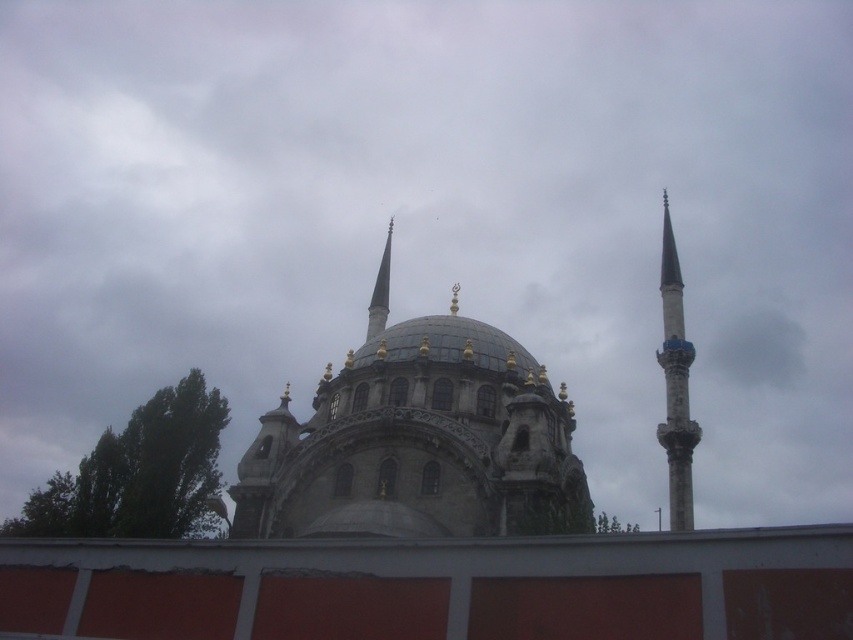
You are an architect assessing the mosque structure. You need to determine which object is shorter between the blue stone dome at center and the blue glossy minaret at right. Which one is shorter?

The blue stone dome at center is shorter than the blue glossy minaret at right.

You are a drone operator planning to fly a drone from the smooth white spire at center to the blue stone dome at center. Given that the drone has a maximum flight height of 10 meters, will it be able to fly horizontally between these two objects without exceeding its height limit?

The blue stone dome at center is taller than the smooth white spire at center. Since the drone needs to fly horizontally between them, it must maintain a height above both objects. The dome being taller means the drone would need to fly at least as high as the dome to pass over it. If the dome exceeds 10 meters in height, the drone cannot fly over it without exceeding its height limit. However, without specific height measurements, we can only conclude that the drone might not be able to safely navigate if

You are a drone operator tasked with capturing aerial footage of the mosque. You need to fly your drone from the blue glossy minaret at right to the smooth white spire at center. Given that your drone has a maximum flight range of 40 meters before needing to return, will it be able to complete the flight without needing to recharge?

The distance between the blue glossy minaret at right and the smooth white spire at center is 39.48 meters, which is within the drone operator s 40 meter range. The drone can complete the flight without needing to recharge.